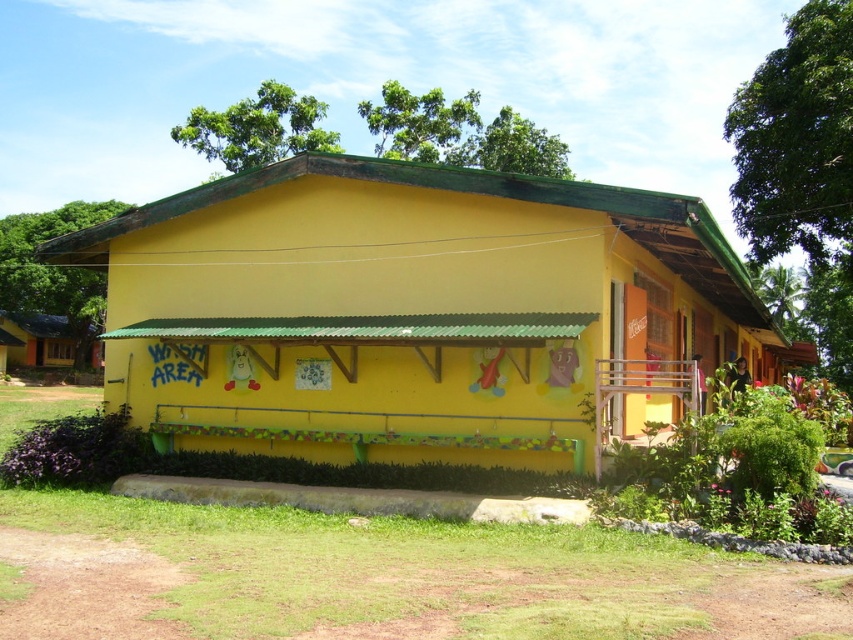
Question: Which object is closer to the camera taking this photo?

Choices:
 (A) yellow matte building at center
 (B) matte yellow hut at lower left

Answer: (A)

Question: Is yellow matte building at center further to camera compared to matte yellow hut at lower left?

Choices:
 (A) yes
 (B) no

Answer: (B)

Question: Is yellow matte building at center bigger than matte yellow hut at lower left?

Choices:
 (A) yes
 (B) no

Answer: (A)

Question: Is yellow matte building at center wider than matte yellow hut at lower left?

Choices:
 (A) yes
 (B) no

Answer: (A)